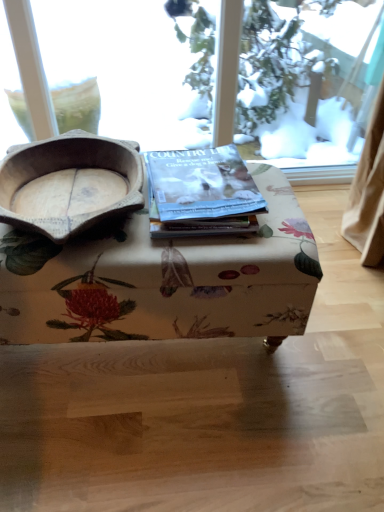
Where is `vacant region above matte paper magazine at center (from a real-world perspective)`? vacant region above matte paper magazine at center (from a real-world perspective) is located at coordinates (196, 177).